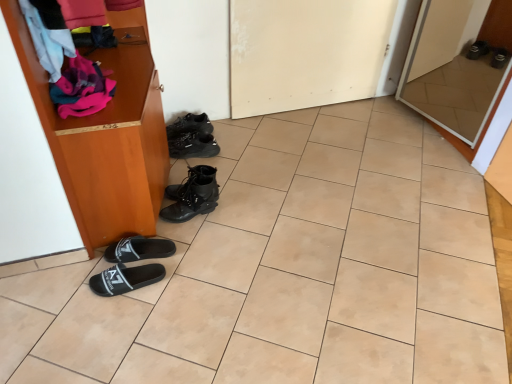
What are the coordinates of `free space in front of black fabric slipper at lower left, the 4th footwear from the top` in the screenshot? It's located at (143, 296).